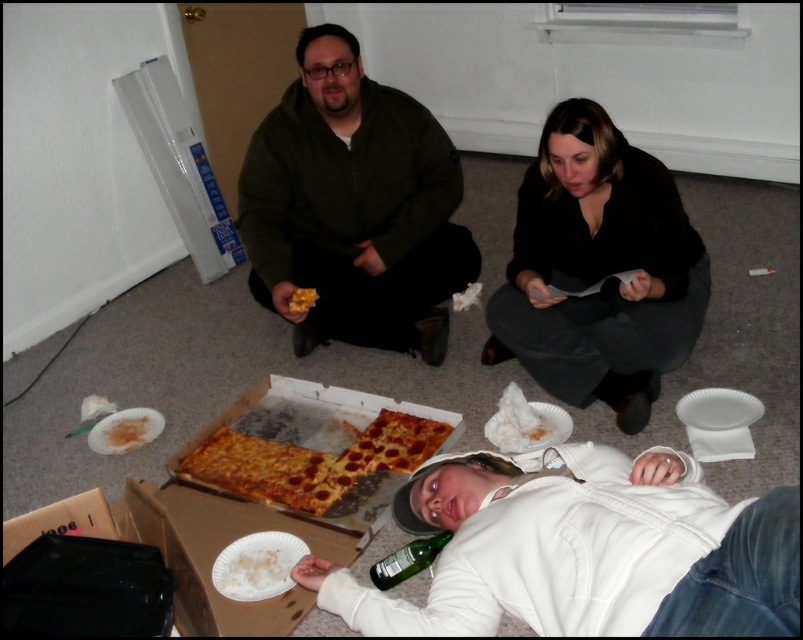
Image resolution: width=803 pixels, height=640 pixels. Identify the location of dark brown fabric at center. (598, 269).

Is point (597, 150) closer to viewer compared to point (412, 541)?

No.

Where is `dark brown fabric at center`? dark brown fabric at center is located at coordinates (598, 269).

Which is in front, point (316, 54) or point (298, 308)?

Positioned in front is point (316, 54).

Between point (255, 141) and point (300, 292), which one is positioned in front?

Point (300, 292)

At what (x,y) coordinates should I click in order to perform the action: click on green fuzzy sweater at center. Please return your answer as a coordinate pair (x, y). The height and width of the screenshot is (640, 803). Looking at the image, I should click on (353, 205).

Is dark brown fabric at center bigger than yellow cheese pizza at center?

Correct, dark brown fabric at center is larger in size than yellow cheese pizza at center.

In the scene shown: Does dark brown fabric at center have a lesser height compared to yellow cheese pizza at center?

No, dark brown fabric at center is not shorter than yellow cheese pizza at center.

Describe the element at coordinates (598, 269) in the screenshot. The height and width of the screenshot is (640, 803). I see `dark brown fabric at center` at that location.

Locate an element on the screen. This screenshot has height=640, width=803. dark brown fabric at center is located at coordinates (598, 269).